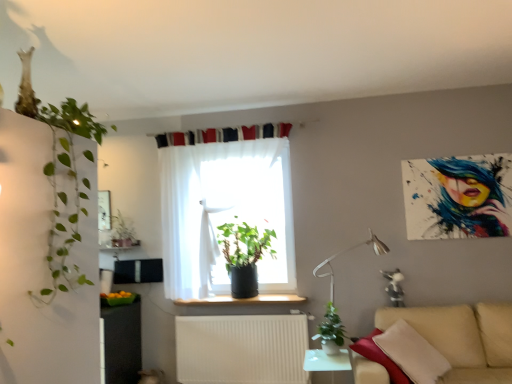
Question: Is sheer white curtain at center completely or partially inside green leafy plant at left, the 4th houseplant viewed from the back?

Choices:
 (A) yes
 (B) no

Answer: (B)

Question: Could you tell me if green leafy plant at left, which is counted as the 2th houseplant, starting from the left, is turned towards sheer white curtain at center?

Choices:
 (A) no
 (B) yes

Answer: (A)

Question: From the image's perspective, is green leafy plant at left, acting as the third houseplant starting from the right, beneath sheer white curtain at center?

Choices:
 (A) no
 (B) yes

Answer: (A)

Question: Does green leafy plant at left, the 4th houseplant viewed from the back, have a greater width compared to sheer white curtain at center?

Choices:
 (A) no
 (B) yes

Answer: (B)

Question: Is green leafy plant at left, which is the first houseplant in front-to-back order, in front of sheer white curtain at center?

Choices:
 (A) no
 (B) yes

Answer: (B)

Question: From the image's perspective, relative to white glossy table at lower center, is black plastic window sill at center above or below?

Choices:
 (A) above
 (B) below

Answer: (A)

Question: Based on their positions, is black plastic window sill at center located to the left or right of white glossy table at lower center?

Choices:
 (A) left
 (B) right

Answer: (A)

Question: From a real-world perspective, is black plastic window sill at center physically located above or below white glossy table at lower center?

Choices:
 (A) above
 (B) below

Answer: (A)

Question: Looking at the image, does black plastic window sill at center seem bigger or smaller compared to white glossy table at lower center?

Choices:
 (A) small
 (B) big

Answer: (A)

Question: Considering the positions of green leafy plant at left, acting as the third houseplant starting from the right, and green matte plant at center, arranged as the 3th houseplant when viewed from the front, in the image, is green leafy plant at left, acting as the third houseplant starting from the right, bigger or smaller than green matte plant at center, arranged as the 3th houseplant when viewed from the front,?

Choices:
 (A) small
 (B) big

Answer: (B)

Question: Relative to green matte plant at center, placed as the second houseplant when sorted from back to front, is green leafy plant at left, acting as the third houseplant starting from the right, in front or behind?

Choices:
 (A) front
 (B) behind

Answer: (A)

Question: Is green leafy plant at left, the 4th houseplant viewed from the back, taller or shorter than green matte plant at center, acting as the 2th houseplant starting from the right?

Choices:
 (A) short
 (B) tall

Answer: (B)

Question: From the image's perspective, relative to green matte plant at center, placed as the second houseplant when sorted from back to front, is green leafy plant at left, which is the first houseplant in front-to-back order, above or below?

Choices:
 (A) below
 (B) above

Answer: (B)

Question: Visually, is green matte plant at lower center, the 1th houseplant in the right-to-left sequence, positioned to the left or to the right of white glossy table at lower center?

Choices:
 (A) right
 (B) left

Answer: (A)

Question: In terms of size, does green matte plant at lower center, the 4th houseplant positioned from the left, appear bigger or smaller than white glossy table at lower center?

Choices:
 (A) small
 (B) big

Answer: (A)